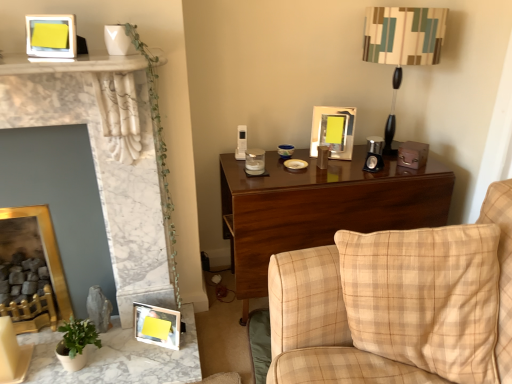
Locate an element on the screen. spots to the right of metallic silver picture frame at upper center, the first picture frame viewed from the right is located at coordinates (366, 150).